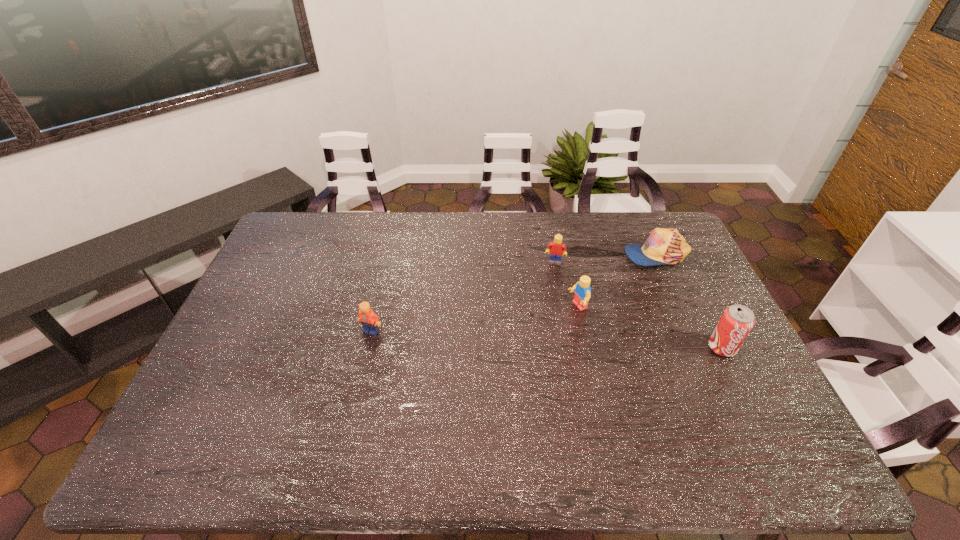
At what (x,y) coordinates should I click in order to perform the action: click on free spot on the desktop that is between the leftmost Lego and the soda can and is positioned on the front-facing side of the third nearest object. Please return your answer as a coordinate pair (x, y). Looking at the image, I should click on (503, 338).

Locate an element on the screen. This screenshot has height=540, width=960. free space on the desktop that is between the leftmost Lego and the nearest object and is positioned on the bill of the cap is located at coordinates (517, 338).

This screenshot has height=540, width=960. Find the location of `free space on the desktop that is between the nearest Lego and the tallest object and is positioned on the front-facing side of the farthest Lego`. free space on the desktop that is between the nearest Lego and the tallest object and is positioned on the front-facing side of the farthest Lego is located at coordinates (543, 339).